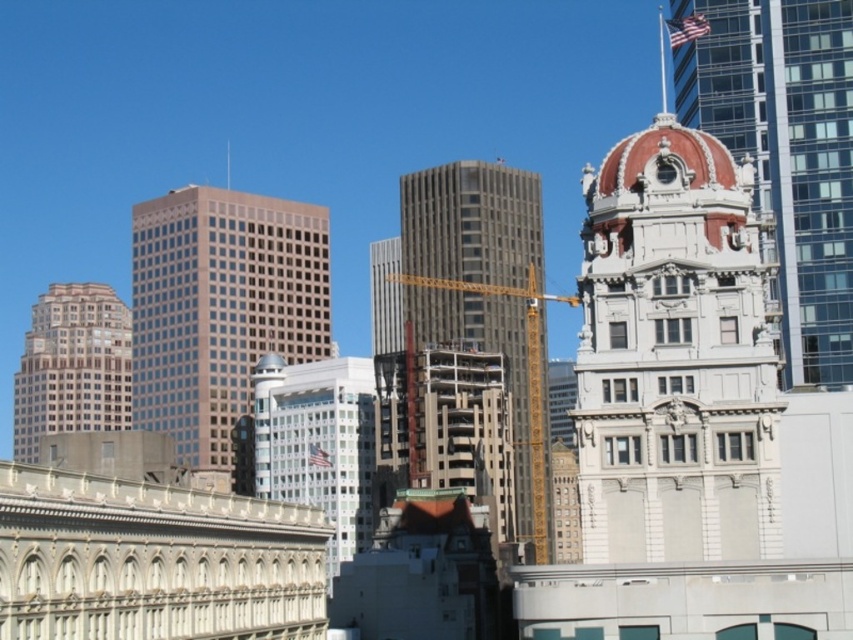
Question: Can you confirm if gray concrete building at center is smaller than white glass building at center?

Choices:
 (A) yes
 (B) no

Answer: (B)

Question: Which object is positioned closest to the white stone building at center?

Choices:
 (A) beige glass skyscraper at left
 (B) matte glass skyscraper at center

Answer: (B)

Question: Considering the real-world distances, which object is closest to the matte glass skyscraper at center?

Choices:
 (A) white glass building at center
 (B) white stone building at center

Answer: (A)

Question: Does white glass building at center have a greater width compared to beige glass skyscraper at left?

Choices:
 (A) yes
 (B) no

Answer: (B)

Question: Estimate the real-world distances between objects in this image. Which object is closer to the white glass building at center?

Choices:
 (A) white stone building at center
 (B) gray concrete building at center
 (C) beige glass skyscraper at left
 (D) matte glass skyscraper at center

Answer: (B)

Question: Does gray concrete building at center come behind beige glass skyscraper at left?

Choices:
 (A) no
 (B) yes

Answer: (A)